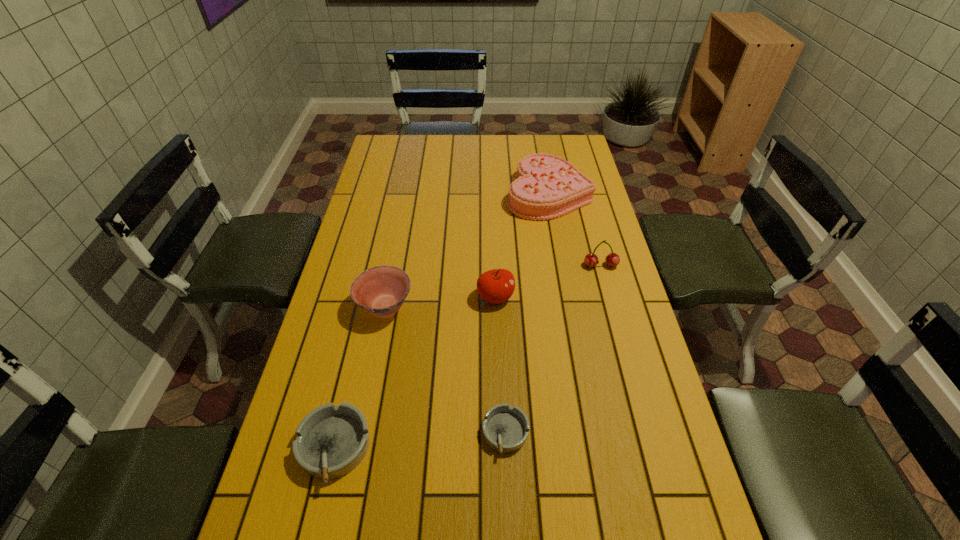
Where is `vacant area that lies between the second farthest object and the fifth tallest object`? vacant area that lies between the second farthest object and the fifth tallest object is located at coordinates (468, 357).

The image size is (960, 540). Find the location of `empty space that is in between the fifth tallest object and the cherry`. empty space that is in between the fifth tallest object and the cherry is located at coordinates (468, 357).

You are a GUI agent. You are given a task and a screenshot of the screen. Output one action in this format:
    pyautogui.click(x=<x>, y=<y>)
    Task: Click on the free space between the left ashtray and the bowl
    
    Given the screenshot: What is the action you would take?
    pyautogui.click(x=360, y=377)

The height and width of the screenshot is (540, 960). Find the location of `vacant area that lies between the apple and the second farthest object`. vacant area that lies between the apple and the second farthest object is located at coordinates (548, 281).

Point out which object is positioned as the nearest to the apple. Please provide its 2D coordinates. Your answer should be formatted as a tuple, i.e. [(x, y)], where the tuple contains the x and y coordinates of a point satisfying the conditions above.

[(381, 290)]

You are a GUI agent. You are given a task and a screenshot of the screen. Output one action in this format:
    pyautogui.click(x=<x>, y=<y>)
    Task: Click on the object that can be found as the closest to the cake
    
    Given the screenshot: What is the action you would take?
    pyautogui.click(x=591, y=260)

At what (x,y) coordinates should I click in order to perform the action: click on free location that satisfies the following two spatial constraints: 1. on the back side of the farthest object; 2. on the right side of the bowl. Please return your answer as a coordinate pair (x, y). Image resolution: width=960 pixels, height=540 pixels. Looking at the image, I should click on (407, 194).

Locate an element on the screen. blank space that satisfies the following two spatial constraints: 1. on the front side of the right ashtray; 2. on the right side of the apple is located at coordinates (500, 434).

Locate an element on the screen. free region that satisfies the following two spatial constraints: 1. on the front side of the shorter ashtray; 2. on the left side of the apple is located at coordinates (500, 434).

At what (x,y) coordinates should I click in order to perform the action: click on blank space that satisfies the following two spatial constraints: 1. on the back side of the apple; 2. on the left side of the farthest object. Please return your answer as a coordinate pair (x, y). The height and width of the screenshot is (540, 960). Looking at the image, I should click on (492, 194).